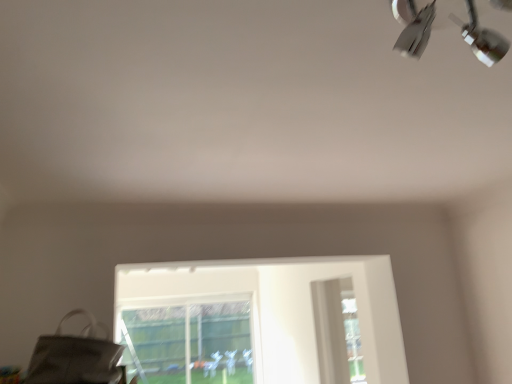
Image resolution: width=512 pixels, height=384 pixels. I want to click on transparent glass bay window at lower center, so click(x=189, y=340).

At what (x,y) coordinates should I click in order to perform the action: click on matte gray messenger bag at lower left. Please return your answer as a coordinate pair (x, y). This screenshot has width=512, height=384. Looking at the image, I should click on (76, 357).

Locate an element on the screen. The height and width of the screenshot is (384, 512). transparent glass bay window at lower center is located at coordinates (189, 340).

Would you say matte gray messenger bag at lower left is part of transparent glass bay window at lower center's contents?

Definitely not — matte gray messenger bag at lower left is not inside transparent glass bay window at lower center.

How different are the orientations of transparent glass bay window at lower center and matte gray messenger bag at lower left in degrees?

transparent glass bay window at lower center and matte gray messenger bag at lower left are facing 86.2 degrees away from each other.

From a real-world perspective, which is physically below, transparent glass bay window at lower center or matte gray messenger bag at lower left?

From a 3D spatial view, transparent glass bay window at lower center is below.

Considering the relative sizes of transparent glass bay window at lower center and matte gray messenger bag at lower left in the image provided, is transparent glass bay window at lower center taller than matte gray messenger bag at lower left?

Yes, transparent glass bay window at lower center is taller than matte gray messenger bag at lower left.

From the image's perspective, which is above, metallic silver lamp at upper right or matte gray messenger bag at lower left?

metallic silver lamp at upper right, from the image's perspective.

Is metallic silver lamp at upper right positioned with its back to matte gray messenger bag at lower left?

No, metallic silver lamp at upper right's orientation is not away from matte gray messenger bag at lower left.

From a real-world perspective, is metallic silver lamp at upper right located higher than matte gray messenger bag at lower left?

Yes, from a real-world perspective, metallic silver lamp at upper right is on top of matte gray messenger bag at lower left.

Which of these two, metallic silver lamp at upper right or transparent glass bay window at lower center, stands taller?

transparent glass bay window at lower center.

From the image's perspective, is metallic silver lamp at upper right located above transparent glass bay window at lower center?

Indeed, from the image's perspective, metallic silver lamp at upper right is shown above transparent glass bay window at lower center.

Which is in front, metallic silver lamp at upper right or transparent glass bay window at lower center?

metallic silver lamp at upper right is in front.

Who is taller, transparent glass bay window at lower center or metallic silver lamp at upper right?

transparent glass bay window at lower center.

Which is behind, transparent glass bay window at lower center or metallic silver lamp at upper right?

transparent glass bay window at lower center is behind.

Between transparent glass bay window at lower center and metallic silver lamp at upper right, which one has smaller width?

transparent glass bay window at lower center is thinner.

Is matte gray messenger bag at lower left thinner than transparent glass bay window at lower center?

No.

Which of these two, matte gray messenger bag at lower left or transparent glass bay window at lower center, is bigger?

transparent glass bay window at lower center.

Does point (37, 347) appear closer or farther from the camera than point (209, 313)?

Clearly, point (37, 347) is closer to the camera than point (209, 313).

How distant is matte gray messenger bag at lower left from transparent glass bay window at lower center?

matte gray messenger bag at lower left and transparent glass bay window at lower center are 14.94 feet apart from each other.

Between matte gray messenger bag at lower left and metallic silver lamp at upper right, which one has smaller width?

Thinner between the two is metallic silver lamp at upper right.

Where is `messenger bag located on the left of metallic silver lamp at upper right`? messenger bag located on the left of metallic silver lamp at upper right is located at coordinates (76, 357).

From a real-world perspective, is matte gray messenger bag at lower left over metallic silver lamp at upper right?

Incorrect, from a real-world perspective, matte gray messenger bag at lower left is lower than metallic silver lamp at upper right.

Which is behind, point (37, 361) or point (472, 19)?

The point (37, 361) is more distant.

Identify the location of bay window below the matte gray messenger bag at lower left (from the image's perspective). [189, 340].

Find the location of a particular element. This screenshot has width=512, height=384. messenger bag on the left of the metallic silver lamp at upper right is located at coordinates (76, 357).

Estimate the real-world distances between objects in this image. Which object is further from transparent glass bay window at lower center, matte gray messenger bag at lower left or metallic silver lamp at upper right?

metallic silver lamp at upper right is positioned further to the anchor transparent glass bay window at lower center.

From the image, which object appears to be nearer to transparent glass bay window at lower center, metallic silver lamp at upper right or matte gray messenger bag at lower left?

matte gray messenger bag at lower left.

Looking at the image, which one is located closer to metallic silver lamp at upper right, transparent glass bay window at lower center or matte gray messenger bag at lower left?

matte gray messenger bag at lower left is closer to metallic silver lamp at upper right.

Which object lies nearer to the anchor point matte gray messenger bag at lower left, metallic silver lamp at upper right or transparent glass bay window at lower center?

metallic silver lamp at upper right.

Based on their spatial positions, is matte gray messenger bag at lower left or transparent glass bay window at lower center further from metallic silver lamp at upper right?

transparent glass bay window at lower center lies further to metallic silver lamp at upper right than the other object.

Based on their spatial positions, is transparent glass bay window at lower center or metallic silver lamp at upper right further from matte gray messenger bag at lower left?

Among the two, transparent glass bay window at lower center is located further to matte gray messenger bag at lower left.

The height and width of the screenshot is (384, 512). Find the location of `messenger bag between metallic silver lamp at upper right and transparent glass bay window at lower center from front to back`. messenger bag between metallic silver lamp at upper right and transparent glass bay window at lower center from front to back is located at coordinates (76, 357).